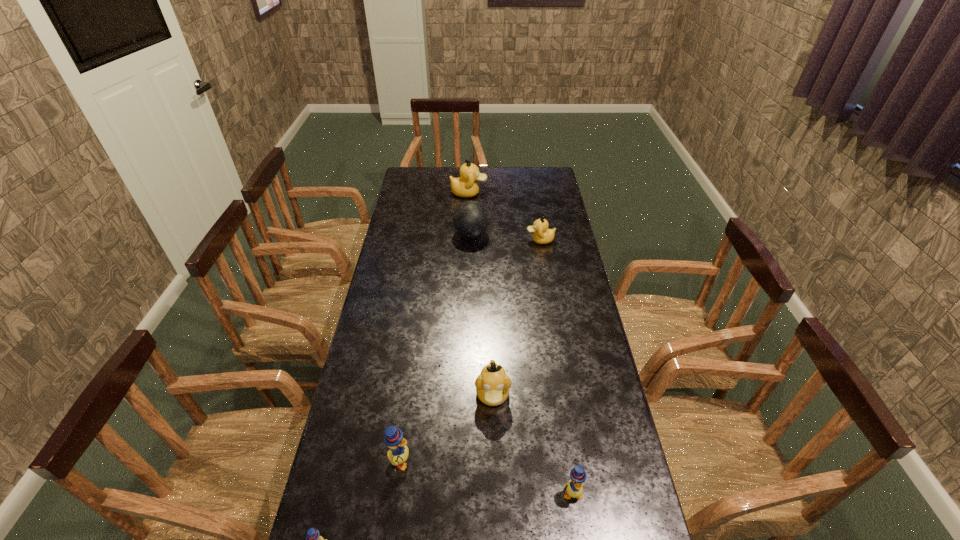
Where is `the farthest duckling`? the farthest duckling is located at coordinates [x=465, y=186].

You are a GUI agent. You are given a task and a screenshot of the screen. Output one action in this format:
    pyautogui.click(x=<x>, y=<y>)
    Task: Click on the biggest tan duckling
    The height and width of the screenshot is (540, 960).
    Given the screenshot: What is the action you would take?
    pyautogui.click(x=465, y=186)

Image resolution: width=960 pixels, height=540 pixels. I want to click on bowling ball, so click(x=470, y=219).

I want to click on the second yellow duckling from right to left, so click(x=398, y=454).

Locate an element on the screen. Image resolution: width=960 pixels, height=540 pixels. the farthest yellow duckling is located at coordinates (398, 454).

Identify the location of the nearest tan duckling. The height and width of the screenshot is (540, 960). (492, 385).

At what (x,y) coordinates should I click in order to perform the action: click on the fourth farthest object. Please return your answer as a coordinate pair (x, y). This screenshot has width=960, height=540. Looking at the image, I should click on (492, 385).

The width and height of the screenshot is (960, 540). What are the coordinates of `the fifth nearest duckling` in the screenshot? It's located at (542, 235).

The image size is (960, 540). I want to click on the rightmost tan duckling, so tap(542, 235).

At what (x,y) coordinates should I click in order to perform the action: click on the second nearest object. Please return your answer as a coordinate pair (x, y). Looking at the image, I should click on (574, 488).